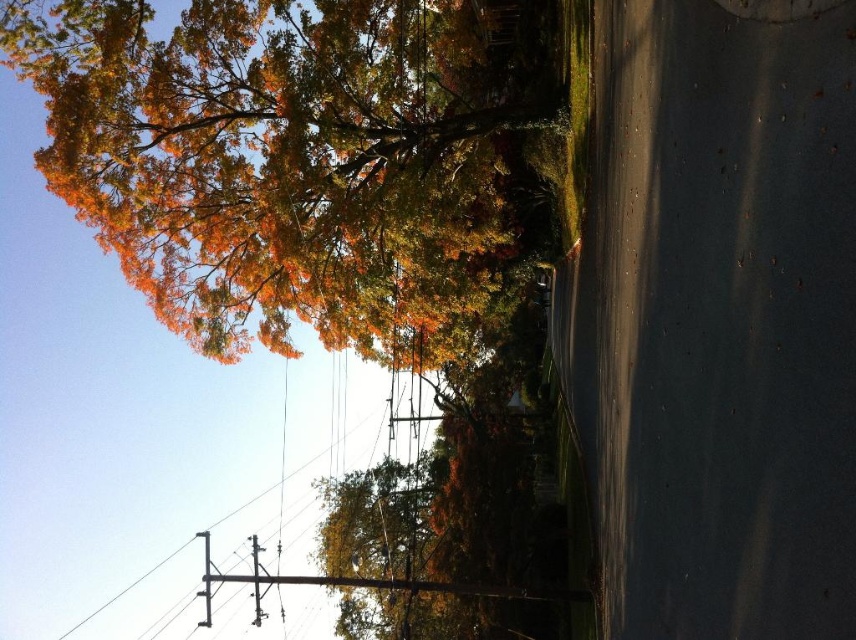
Does autumn leaves at upper left have a greater height compared to metallic gray telegraph pole at center?

Correct, autumn leaves at upper left is much taller as metallic gray telegraph pole at center.

This screenshot has height=640, width=856. What are the coordinates of `autumn leaves at upper left` in the screenshot? It's located at point(283,160).

Between point (498, 278) and point (256, 570), which one is positioned behind?

The point (498, 278) is more distant.

Identify the location of autumn leaves at upper left. (283, 160).

Is metallic gray telegraph pole at center-left positioned in front of metallic gray telegraph pole at center?

Yes, it is in front of metallic gray telegraph pole at center.

You are a GUI agent. You are given a task and a screenshot of the screen. Output one action in this format:
    pyautogui.click(x=<x>, y=<y>)
    Task: Click on the metallic gray telegraph pole at center-left
    The width and height of the screenshot is (856, 640).
    Given the screenshot: What is the action you would take?
    [x=205, y=579]

Consider the image. Between autumn leaves at upper left and metallic gray telegraph pole at center-left, which one has less height?

With less height is metallic gray telegraph pole at center-left.

Who is higher up, autumn leaves at upper left or metallic gray telegraph pole at center-left?

autumn leaves at upper left

Which is in front, point (500, 180) or point (209, 556)?

Point (500, 180) is more forward.

The height and width of the screenshot is (640, 856). I want to click on autumn leaves at upper left, so click(x=283, y=160).